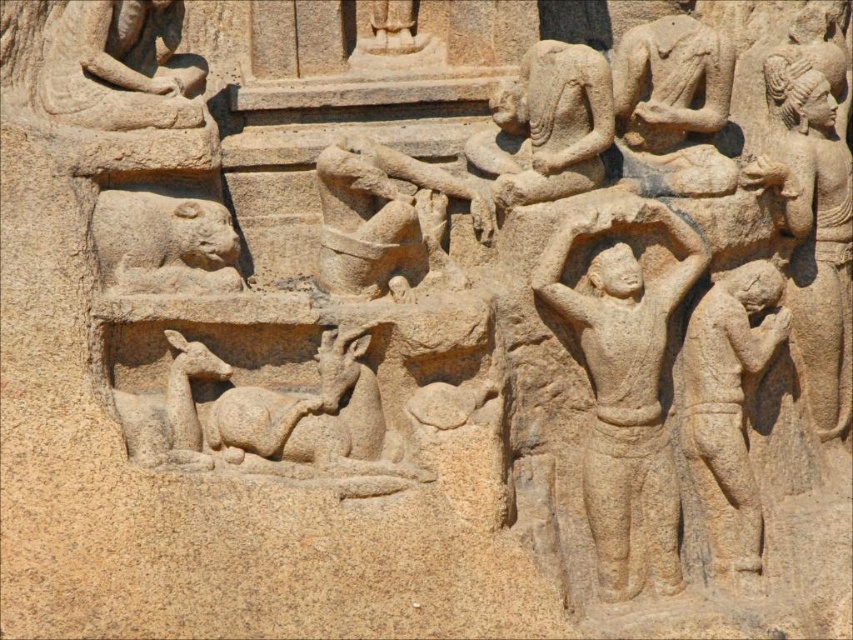
Is smooth beige statue at right thinner than smooth stone figure at right?

In fact, smooth beige statue at right might be wider than smooth stone figure at right.

Who is lower down, smooth beige statue at right or smooth stone figure at right?

smooth stone figure at right is below.

Who is more forward, (822, 109) or (693, 400)?

Point (693, 400) is in front.

Identify the location of smooth beige statue at right. (811, 228).

Can you confirm if smooth stone figure at right is positioned above smooth stone lion at lower left?

Incorrect, smooth stone figure at right is not positioned above smooth stone lion at lower left.

Who is lower down, smooth stone figure at right or smooth stone lion at lower left?

Positioned lower is smooth stone figure at right.

Does point (730, 321) lie behind point (206, 273)?

That is True.

Where is `smooth stone figure at right`? The image size is (853, 640). smooth stone figure at right is located at coordinates [x=728, y=404].

Is smooth stone figure at upper left further to camera compared to smooth stone lion at lower left?

Yes, it is behind smooth stone lion at lower left.

Based on the photo, measure the distance between smooth stone figure at upper left and camera.

A distance of 3.02 meters exists between smooth stone figure at upper left and camera.

From the picture: Who is more distant from viewer, (85,22) or (160,205)?

The point (85,22) is more distant.

You are a GUI agent. You are given a task and a screenshot of the screen. Output one action in this format:
    pyautogui.click(x=<x>, y=<y>)
    Task: Click on the smooth stone figure at upper left
    The image size is (853, 640).
    Given the screenshot: What is the action you would take?
    pos(115,70)